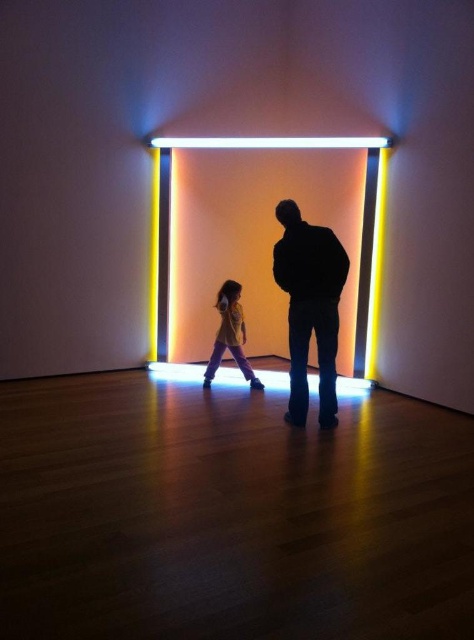
You are a photographer trying to capture the two people in the scene. You want to ensure that the black matte jacket at center and the yellow cotton shirt at center are both visible in your photo. Based on their positions, which one should you focus on first to ensure both are in frame?

The black matte jacket at center is positioned on the right side of yellow cotton shirt at center, so focusing on the yellow cotton shirt at center first will ensure both are in frame as the black matte jacket at center is to its right.

You are a photographer trying to capture the white fluorescent tube at center and the yellow cotton shirt at center in the same frame. Based on their positions, which object should you focus on first to ensure both are in focus?

The white fluorescent tube at center is located above the yellow cotton shirt at center. To ensure both are in focus, you should focus on the yellow cotton shirt at center first since it is closer to the camera, and the tube above it will fall within the depth of field.

You are standing in front of the light installation and see two points marked in the scene. Which point, point (x=338, y=276) or point (x=365, y=234), is closer to you?

Point (x=338, y=276) is closer to the viewer than point (x=365, y=234).